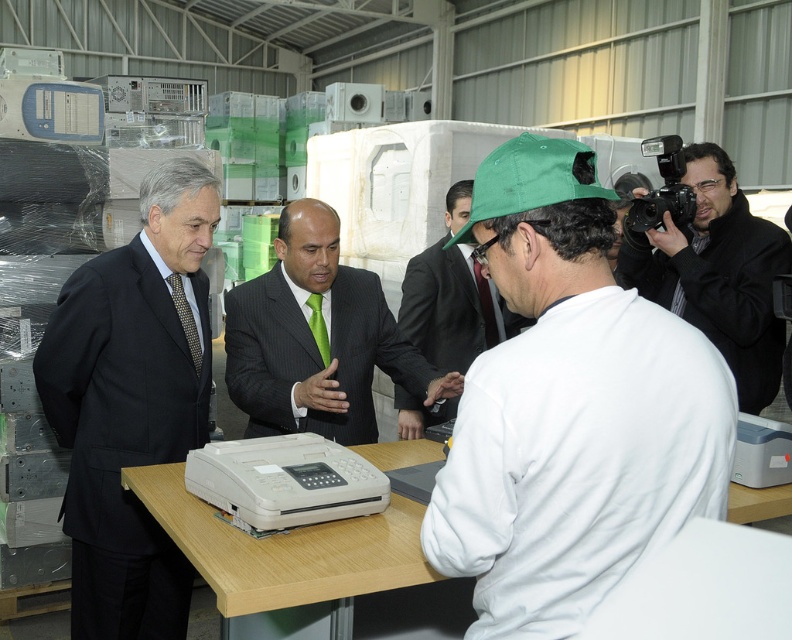
You are a security guard in the warehouse and need to identify the tallest object between the black suit at left and the beige wood table at center. Which one is taller?

The black suit at left is taller than the beige wood table at center according to the description.

From the picture: You are a customer in the warehouse and see the white matte shirt at center and the white matte cap at center. Which one is more to the right?

The white matte shirt at center is positioned on the right side of white matte cap at center, so the white matte shirt at center is more to the right.

You are a security guard in the warehouse and need to locate the black suit at left. According to the coordinates provided, where should you look to find it?

The black suit at left is located at coordinates point (132, 403).